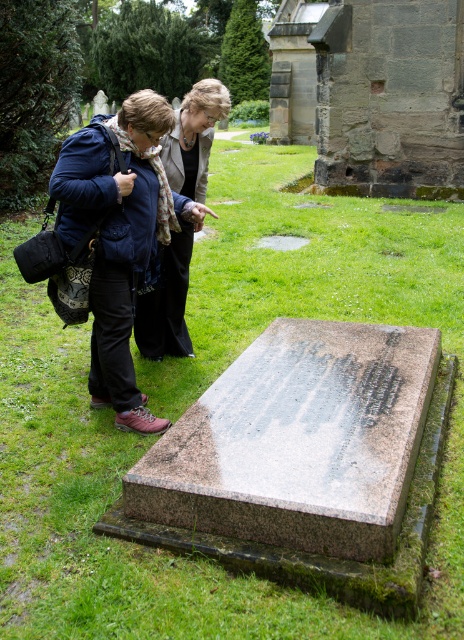
Question: Among these points, which one is farthest from the camera?

Choices:
 (A) (303, 477)
 (B) (100, 196)
 (C) (193, 147)

Answer: (C)

Question: Can you confirm if granite gravestone at center is thinner than matte blue jacket at upper left?

Choices:
 (A) no
 (B) yes

Answer: (A)

Question: Which point is closer to the camera taking this photo?

Choices:
 (A) (269, 531)
 (B) (176, 157)
 (C) (116, 424)

Answer: (A)

Question: Where is granite gravestone at center located in relation to matte blue jacket at upper left in the image?

Choices:
 (A) right
 (B) left

Answer: (A)

Question: Considering the relative positions of granite gravestone at center and matte black jacket at center in the image provided, where is granite gravestone at center located with respect to matte black jacket at center?

Choices:
 (A) left
 (B) right

Answer: (B)

Question: Among these objects, which one is nearest to the camera?

Choices:
 (A) matte black jacket at center
 (B) matte blue jacket at upper left

Answer: (B)